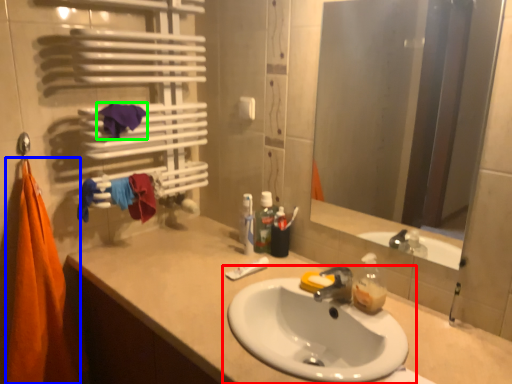
Question: Considering the real-world distances, which object is closest to sink (highlighted by a red box)? beach towel (highlighted by a blue box) or beach towel (highlighted by a green box).

Choices:
 (A) beach towel
 (B) beach towel

Answer: (A)